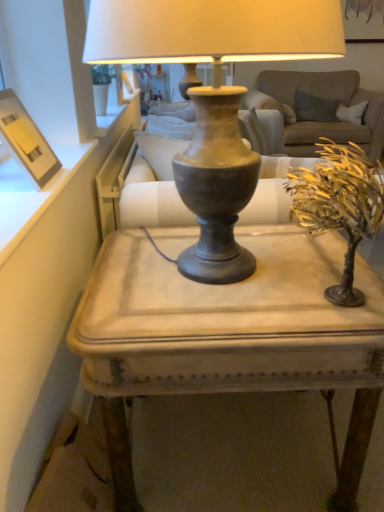
Locate an element on the screen. This screenshot has width=384, height=512. free point below matte gray vase at center (from a real-world perspective) is located at coordinates (220, 284).